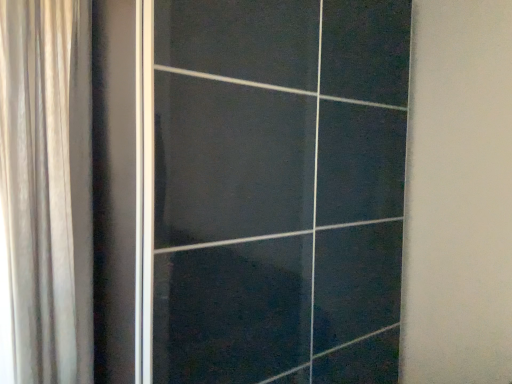
Describe the element at coordinates (249, 189) in the screenshot. This screenshot has height=384, width=512. I see `black glossy door at center` at that location.

At what (x,y) coordinates should I click in order to perform the action: click on black glossy door at center. Please return your answer as a coordinate pair (x, y). The width and height of the screenshot is (512, 384). Looking at the image, I should click on (249, 189).

In order to face black glossy door at center, should I rotate leftwards or rightwards?

Rotate right and turn 2.419 degrees.

Measure the distance between black glossy door at center and camera.

black glossy door at center and camera are 1.31 meters apart from each other.

This screenshot has width=512, height=384. What do you see at coordinates (46, 189) in the screenshot?
I see `silky beige curtain at left` at bounding box center [46, 189].

What is the approximate height of silky beige curtain at left?

5.45 feet.

Locate an element on the screen. silky beige curtain at left is located at coordinates (46, 189).

The height and width of the screenshot is (384, 512). Identify the location of black glossy door at center. (249, 189).

Considering the positions of objects black glossy door at center and silky beige curtain at left in the image provided, who is more to the right, black glossy door at center or silky beige curtain at left?

black glossy door at center is more to the right.

Who is more distant, black glossy door at center or silky beige curtain at left?

silky beige curtain at left is further away from the camera.

Is point (349, 376) positioned after point (7, 72)?

Yes, point (349, 376) is behind point (7, 72).

From the image's perspective, is black glossy door at center on silky beige curtain at left?

No.

From a real-world perspective, who is located lower, black glossy door at center or silky beige curtain at left?

In real-world perspective, black glossy door at center is lower.

Is black glossy door at center wider than silky beige curtain at left?

Indeed, black glossy door at center has a greater width compared to silky beige curtain at left.

Between black glossy door at center and silky beige curtain at left, which one has more height?

With more height is black glossy door at center.

Can you confirm if black glossy door at center is smaller than silky beige curtain at left?

Incorrect, black glossy door at center is not smaller in size than silky beige curtain at left.

Would you say silky beige curtain at left is part of black glossy door at center's contents?

No, silky beige curtain at left is not surrounded by black glossy door at center.

Are black glossy door at center and silky beige curtain at left making contact?

black glossy door at center and silky beige curtain at left are not in contact.

Is black glossy door at center looking in the opposite direction of silky beige curtain at left?

black glossy door at center is not turned away from silky beige curtain at left.

In the scene shown: How many degrees apart are the facing directions of black glossy door at center and silky beige curtain at left?

There is a 1.02-degree angle between the facing directions of black glossy door at center and silky beige curtain at left.

In order to click on curtain that appears above the black glossy door at center (from a real-world perspective) in this screenshot , I will do `click(46, 189)`.

Considering the positions of objects silky beige curtain at left and black glossy door at center in the image provided, who is more to the right, silky beige curtain at left or black glossy door at center?

black glossy door at center is more to the right.

Based on the photo, which object is closer to the camera, silky beige curtain at left or black glossy door at center?

black glossy door at center is in front.

Does point (69, 363) appear closer or farther from the camera than point (148, 75)?

Point (69, 363) appears to be farther away from the viewer than point (148, 75).

From the image's perspective, which one is positioned higher, silky beige curtain at left or black glossy door at center?

silky beige curtain at left.

From a real-world perspective, is silky beige curtain at left on top of black glossy door at center?

Yes.

Does silky beige curtain at left have a lesser width compared to black glossy door at center?

Indeed, silky beige curtain at left has a lesser width compared to black glossy door at center.

Can you confirm if silky beige curtain at left is taller than black glossy door at center?

No.

Is silky beige curtain at left bigger than black glossy door at center?

No.

Do you think silky beige curtain at left is within black glossy door at center, or outside of it?

silky beige curtain at left is not enclosed by black glossy door at center.

Is silky beige curtain at left far from black glossy door at center?

No.

Could you tell me if silky beige curtain at left is facing black glossy door at center?

No, silky beige curtain at left is not facing towards black glossy door at center.

At what (x,y) coordinates should I click in order to perform the action: click on door below the silky beige curtain at left (from the image's perspective). Please return your answer as a coordinate pair (x, y). Looking at the image, I should click on (249, 189).

Identify the location of curtain behind the black glossy door at center. (46, 189).

Locate an element on the screen. The height and width of the screenshot is (384, 512). curtain on the left of black glossy door at center is located at coordinates (46, 189).